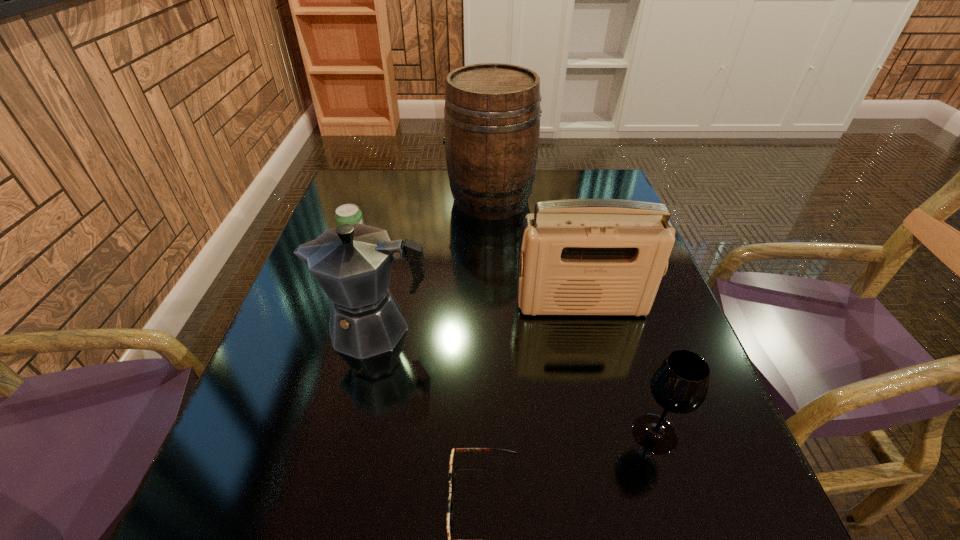
You are a GUI agent. You are given a task and a screenshot of the screen. Output one action in this format:
    pyautogui.click(x=<x>, y=<y>)
    Task: Click on the farthest object
    
    Given the screenshot: What is the action you would take?
    pyautogui.click(x=492, y=111)

Where is `the tallest object`? the tallest object is located at coordinates (492, 111).

I want to click on radio receiver, so click(588, 256).

Where is `coffeepot`? coffeepot is located at coordinates pyautogui.click(x=352, y=263).

Identify the location of wineglass. (679, 384).

You are a GUI agent. You are given a task and a screenshot of the screen. Output one action in this format:
    pyautogui.click(x=<x>, y=<y>)
    Task: Click on the third shortest object
    This screenshot has width=960, height=540.
    Given the screenshot: What is the action you would take?
    pyautogui.click(x=679, y=384)

Locate an element on the screen. soda is located at coordinates (348, 213).

Where is `the second shortest object`? Image resolution: width=960 pixels, height=540 pixels. the second shortest object is located at coordinates (348, 213).

At what (x,y) coordinates should I click in order to perform the action: click on vacant space located on the side of the farthest object near the bung hole. Please return your answer as a coordinate pair (x, y). This screenshot has height=540, width=960. Looking at the image, I should click on (403, 199).

Find the location of a particular element. Image resolution: width=960 pixels, height=540 pixels. vacant space located on the side of the farthest object near the bung hole is located at coordinates (340, 199).